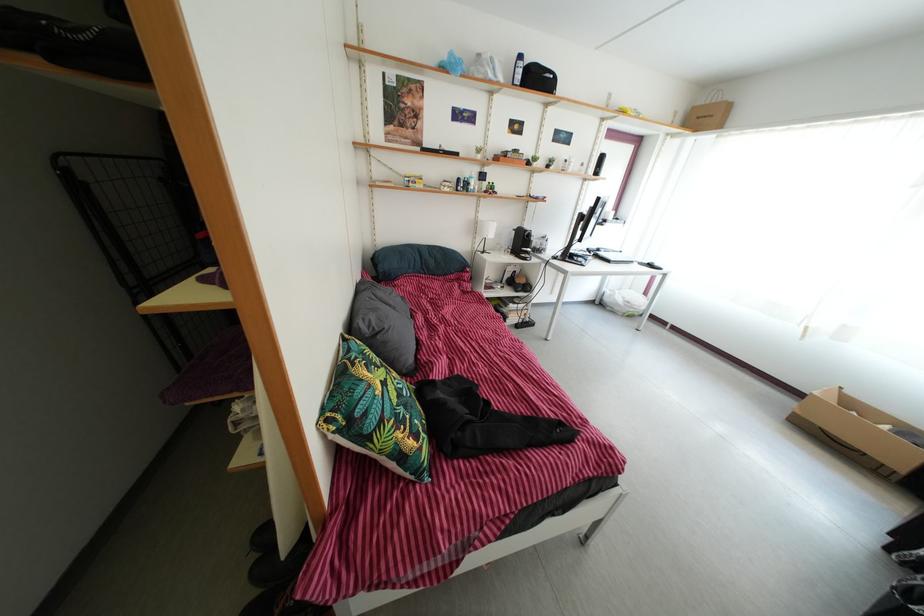
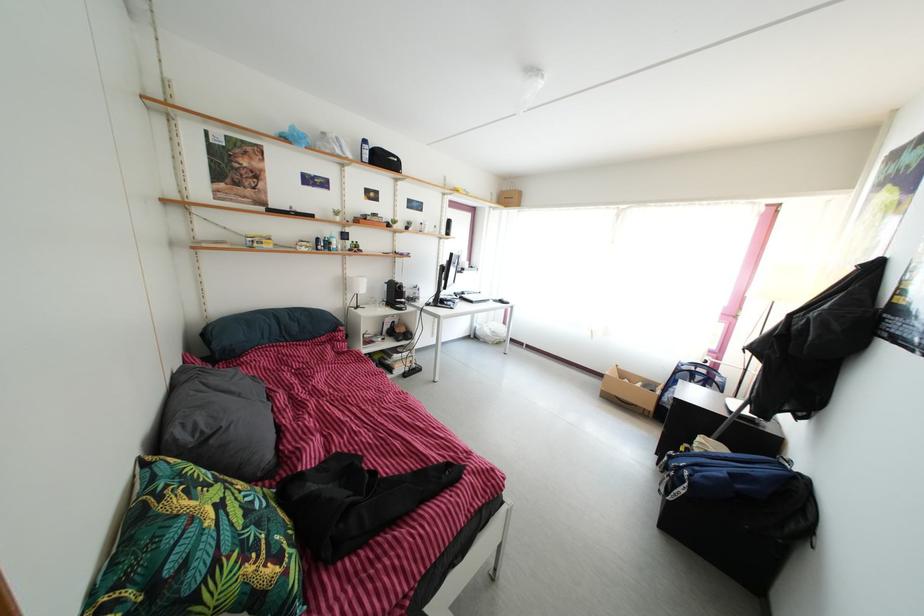
Find the pixel in the second image that matches [411,416] in the first image.

(264, 533)